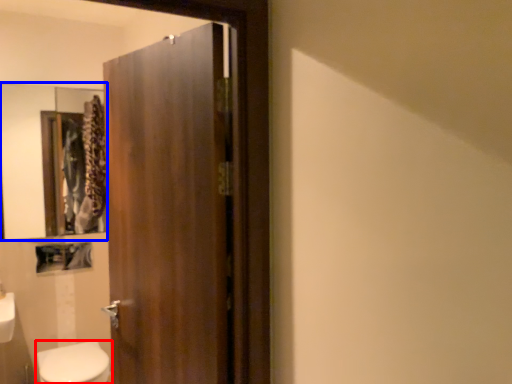
Question: Which object appears farthest to the camera in this image, bidet (highlighted by a red box) or mirror (highlighted by a blue box)?

Choices:
 (A) bidet
 (B) mirror

Answer: (B)